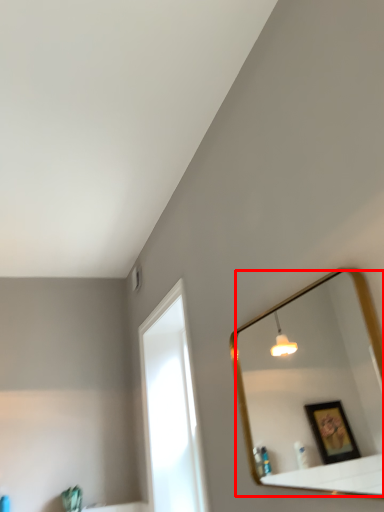
Question: From the image's perspective, where is mirror (annotated by the red box) located relative to window?

Choices:
 (A) below
 (B) above

Answer: (B)